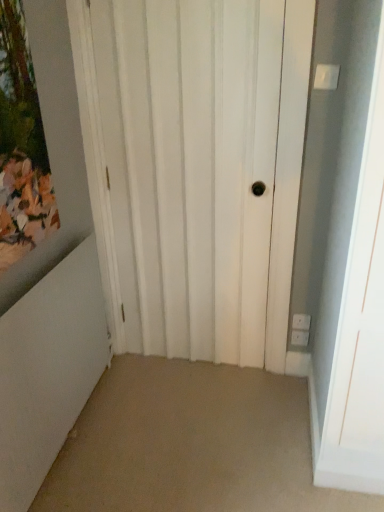
Describe the element at coordinates (195, 169) in the screenshot. I see `white matte door at center` at that location.

Image resolution: width=384 pixels, height=512 pixels. I want to click on white matte door at center, so coord(195,169).

The image size is (384, 512). Describe the element at coordinates (54, 147) in the screenshot. I see `wooden painted picture frame at upper left` at that location.

What are the coordinates of `wooden painted picture frame at upper left` in the screenshot? It's located at tap(54, 147).

I want to click on white matte door at center, so click(195, 169).

Would you say white matte door at center is to the left or to the right of wooden painted picture frame at upper left in the picture?

In the image, white matte door at center appears on the right side of wooden painted picture frame at upper left.

Is white matte door at center in front of or behind wooden painted picture frame at upper left in the image?

Clearly, white matte door at center is behind wooden painted picture frame at upper left.

Is point (306, 65) closer or farther from the camera than point (62, 129)?

Point (306, 65) is closer to the camera than point (62, 129).

Based on the photo, from the image's perspective, relative to wooden painted picture frame at upper left, is white matte door at center above or below?

From the image's perspective, white matte door at center appears below wooden painted picture frame at upper left.

From a real-world perspective, is white matte door at center located beneath wooden painted picture frame at upper left?

Correct, in the physical world, white matte door at center is lower than wooden painted picture frame at upper left.

Based on the photo, which of these two, white matte door at center or wooden painted picture frame at upper left, is thinner?

With smaller width is white matte door at center.

In terms of height, does white matte door at center look taller or shorter compared to wooden painted picture frame at upper left?

Considering their sizes, white matte door at center has more height than wooden painted picture frame at upper left.

From the picture: Can you confirm if white matte door at center is bigger than wooden painted picture frame at upper left?

Indeed, white matte door at center has a larger size compared to wooden painted picture frame at upper left.

Is white matte door at center outside of wooden painted picture frame at upper left?

Absolutely, white matte door at center is external to wooden painted picture frame at upper left.

Would you say white matte door at center is a long distance from wooden painted picture frame at upper left?

white matte door at center is actually quite close to wooden painted picture frame at upper left.

Consider the image. Is white matte door at center facing towards wooden painted picture frame at upper left?

Yes, white matte door at center is turned towards wooden painted picture frame at upper left.

Where is `picture frame on the left side of white matte door at center`? picture frame on the left side of white matte door at center is located at coordinates (54, 147).

Visually, is wooden painted picture frame at upper left positioned to the left or to the right of white matte door at center?

Based on their positions, wooden painted picture frame at upper left is located to the left of white matte door at center.

Between wooden painted picture frame at upper left and white matte door at center, which one is positioned behind?

white matte door at center is further away from the camera.

Considering the points (34, 14) and (124, 258), which point is in front, point (34, 14) or point (124, 258)?

The point (34, 14) is closer.

From the image's perspective, which object appears higher, wooden painted picture frame at upper left or white matte door at center?

wooden painted picture frame at upper left is shown above in the image.

From a real-world perspective, which object stands above the other?

wooden painted picture frame at upper left, from a real-world perspective.

Considering the relative sizes of wooden painted picture frame at upper left and white matte door at center in the image provided, is wooden painted picture frame at upper left wider than white matte door at center?

Indeed, wooden painted picture frame at upper left has a greater width compared to white matte door at center.

Looking at this image, considering the sizes of objects wooden painted picture frame at upper left and white matte door at center in the image provided, who is shorter, wooden painted picture frame at upper left or white matte door at center?

Standing shorter between the two is wooden painted picture frame at upper left.

Looking at the image, does wooden painted picture frame at upper left seem bigger or smaller compared to white matte door at center?

Clearly, wooden painted picture frame at upper left is smaller in size than white matte door at center.

Is wooden painted picture frame at upper left inside or outside of white matte door at center?

wooden painted picture frame at upper left is outside white matte door at center.

Are wooden painted picture frame at upper left and white matte door at center located far from each other?

They are positioned close to each other.

Is wooden painted picture frame at upper left positioned with its back to white matte door at center?

wooden painted picture frame at upper left does not have its back to white matte door at center.

How distant is wooden painted picture frame at upper left from white matte door at center?

wooden painted picture frame at upper left and white matte door at center are 43.29 centimeters apart from each other.

Where is `picture frame in front of the white matte door at center`? The width and height of the screenshot is (384, 512). picture frame in front of the white matte door at center is located at coordinates pyautogui.click(x=54, y=147).

You are a GUI agent. You are given a task and a screenshot of the screen. Output one action in this format:
    pyautogui.click(x=<x>, y=<y>)
    Task: Click on the picture frame lying above the white matte door at center (from the image's perspective)
    The height and width of the screenshot is (512, 384).
    Given the screenshot: What is the action you would take?
    pyautogui.click(x=54, y=147)

Locate an element on the screen. This screenshot has height=512, width=384. picture frame located in front of the white matte door at center is located at coordinates (54, 147).